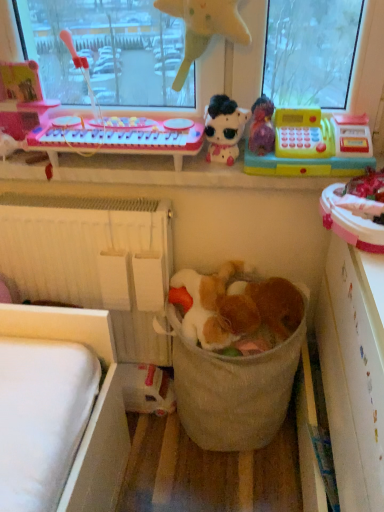
Question: Considering their positions, is white plastic shelf at right located in front of or behind beige fabric laundry basket at center?

Choices:
 (A) behind
 (B) front

Answer: (B)

Question: Looking at their shapes, would you say white plastic shelf at right is wider or thinner than beige fabric laundry basket at center?

Choices:
 (A) thin
 (B) wide

Answer: (B)

Question: Which object is the farthest from the fuzzy fabric stuffed animal at center, positioned as the 4th toy in left-to-right order?

Choices:
 (A) white plastic shelf at right
 (B) white matte plush toy at upper center, which is the third toy in right-to-left order
 (C) pink plastic keyboard at upper left
 (D) beige fabric laundry basket at center
 (E) yellow plastic cash register at upper right, which is the fifth toy in left-to-right order

Answer: (C)

Question: Based on their relative distances, which object is nearer to the white textured radiator at lower left?

Choices:
 (A) beige fabric laundry basket at center
 (B) fuzzy fabric stuffed animal at center, which is the 2th toy in right-to-left order
 (C) white plastic shelf at right
 (D) pink plastic keyboard at upper left
 (E) yellow plastic cash register at upper right, the fourth toy from the top

Answer: (B)